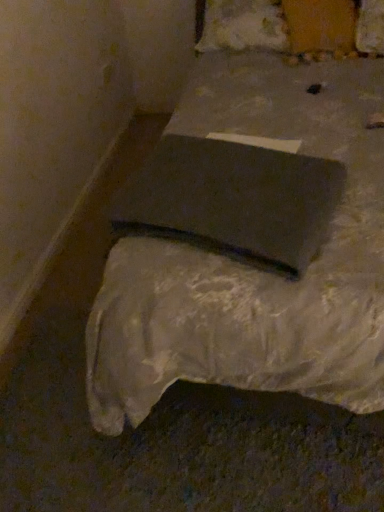
Question: Are white cotton pillow at upper center and matte gray bed at center making contact?

Choices:
 (A) no
 (B) yes

Answer: (A)

Question: Can you confirm if white cotton pillow at upper center is bigger than matte gray bed at center?

Choices:
 (A) yes
 (B) no

Answer: (B)

Question: Considering the relative positions of white cotton pillow at upper center and matte gray bed at center in the image provided, is white cotton pillow at upper center to the right of matte gray bed at center from the viewer's perspective?

Choices:
 (A) no
 (B) yes

Answer: (A)

Question: Can you confirm if white cotton pillow at upper center is shorter than matte gray bed at center?

Choices:
 (A) no
 (B) yes

Answer: (B)

Question: Is white cotton pillow at upper center positioned with its back to matte gray bed at center?

Choices:
 (A) yes
 (B) no

Answer: (A)

Question: Considering their positions, is matte gray pad at center located in front of or behind white cotton pillow at upper center?

Choices:
 (A) front
 (B) behind

Answer: (A)

Question: Is matte gray pad at center spatially inside white cotton pillow at upper center, or outside of it?

Choices:
 (A) inside
 (B) outside

Answer: (B)

Question: Is matte gray pad at center bigger or smaller than white cotton pillow at upper center?

Choices:
 (A) big
 (B) small

Answer: (B)

Question: Does point (238, 193) appear closer or farther from the camera than point (249, 12)?

Choices:
 (A) farther
 (B) closer

Answer: (B)

Question: From a real-world perspective, relative to matte gray bed at center, is matte gray pad at center vertically above or below?

Choices:
 (A) above
 (B) below

Answer: (A)

Question: Considering the positions of matte gray pad at center and matte gray bed at center in the image, is matte gray pad at center bigger or smaller than matte gray bed at center?

Choices:
 (A) big
 (B) small

Answer: (B)

Question: Is point (190, 155) closer or farther from the camera than point (208, 286)?

Choices:
 (A) closer
 (B) farther

Answer: (B)

Question: Looking at their shapes, would you say matte gray pad at center is wider or thinner than matte gray bed at center?

Choices:
 (A) wide
 (B) thin

Answer: (B)

Question: From a real-world perspective, is white cotton pillow at upper center above or below matte gray bed at center?

Choices:
 (A) above
 (B) below

Answer: (A)

Question: Looking at their shapes, would you say white cotton pillow at upper center is wider or thinner than matte gray bed at center?

Choices:
 (A) thin
 (B) wide

Answer: (A)